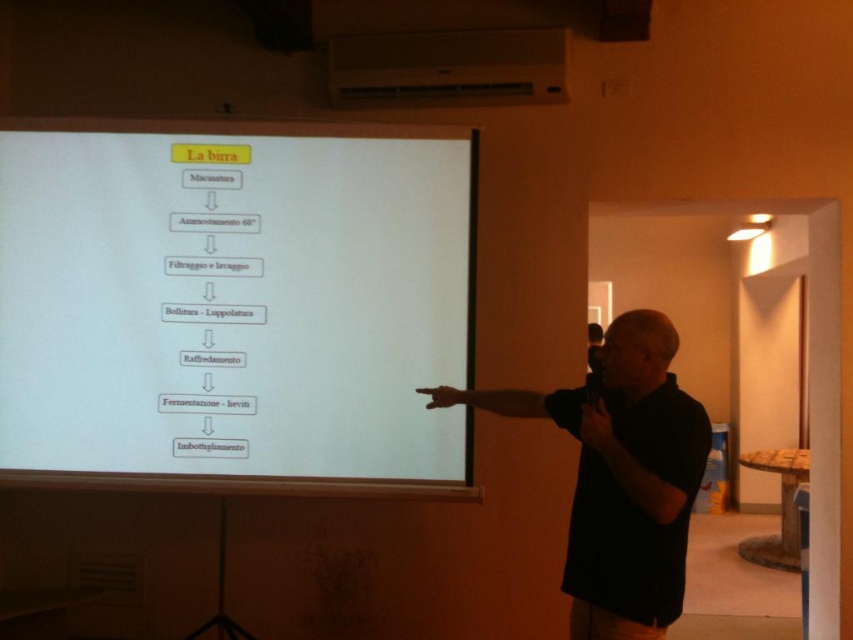
Is white paper at center to the left of white plastic projector at upper center from the viewer's perspective?

Indeed, white paper at center is positioned on the left side of white plastic projector at upper center.

Identify the location of white paper at center. (235, 305).

Can you confirm if black matte shirt at center is wider than white plastic projector at upper center?

No.

Does black matte shirt at center have a larger size compared to white plastic projector at upper center?

Yes.

Locate an element on the screen. Image resolution: width=853 pixels, height=640 pixels. black matte shirt at center is located at coordinates (621, 476).

Based on the photo, is white paper at center to the left of black matte shirt at center from the viewer's perspective?

Indeed, white paper at center is positioned on the left side of black matte shirt at center.

Who is more distant from viewer, (471, 419) or (601, 476)?

Positioned behind is point (471, 419).

Is point (171, 317) more distant than point (624, 524)?

That is True.

Find the location of `white paper at center`. white paper at center is located at coordinates (235, 305).